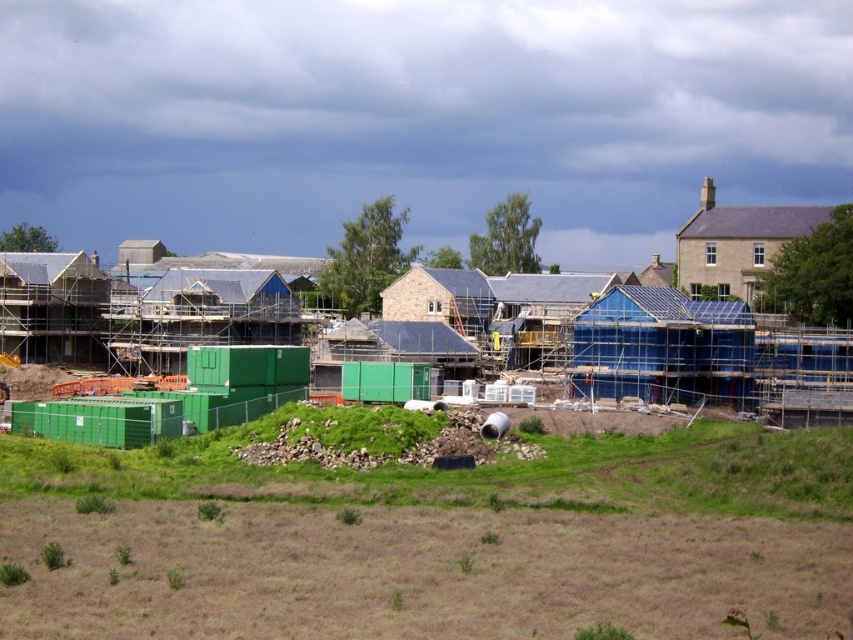
You are a construction worker who needs to place a new tool on the ground near the green grass at lower center and the green plastic containers at center. Which surface is shorter so the tool won

The green grass at lower center has a lesser height compared to the green plastic containers at center, so the tool should be placed on the green grass at lower center to ensure stability.

You are a construction worker standing at point (428,536). What do you see directly below you?

At point (428,536) lies green grass at lower center.